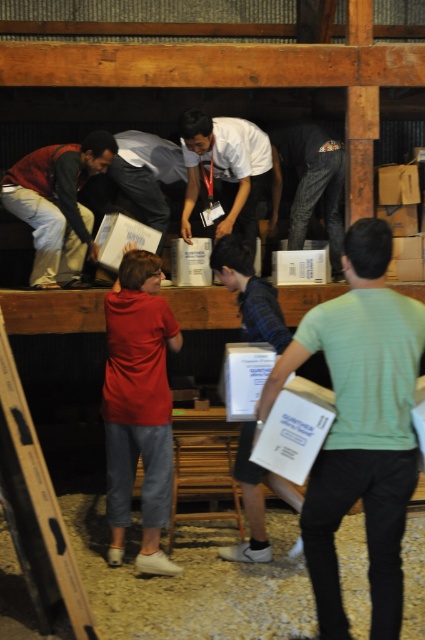
Image resolution: width=425 pixels, height=640 pixels. Describe the element at coordinates (138, 404) in the screenshot. I see `red cotton shirt at center` at that location.

At what (x,y) coordinates should I click in order to perform the action: click on red cotton shirt at center. Please return your answer as a coordinate pair (x, y). Looking at the image, I should click on tap(138, 404).

Is white matte shirt at center positioned behind denim jeans at center?

No.

Does white matte shirt at center appear under denim jeans at center?

Actually, white matte shirt at center is above denim jeans at center.

Which is behind, point (252, 200) or point (292, 202)?

The point (292, 202) is more distant.

The image size is (425, 640). Identify the location of white matte shirt at center. (224, 170).

Is matte brown jacket at left thinner than denim jeans at center?

In fact, matte brown jacket at left might be wider than denim jeans at center.

Who is more forward, (42, 160) or (328, 168)?

Point (42, 160)

Between point (79, 221) and point (282, 161), which one is positioned behind?

The point (282, 161) is behind.

Identify the location of matte brown jacket at left. (57, 205).